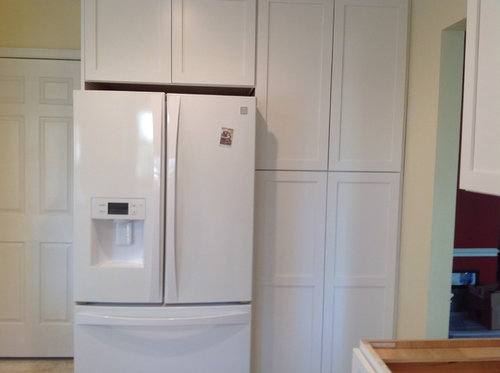
Identify the location of floor. (14, 366).